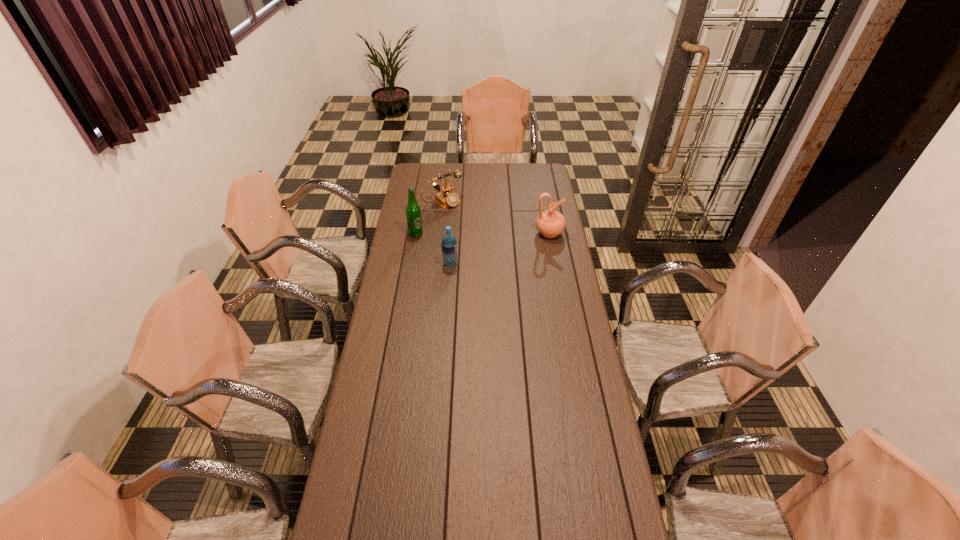
You are a GUI agent. You are given a task and a screenshot of the screen. Output one action in this format:
    pyautogui.click(x=<x>, y=<y>)
    Task: Click on the free space that is in between the water bottle and the farthest object
    Image resolution: width=960 pixels, height=540 pixels.
    Given the screenshot: What is the action you would take?
    pyautogui.click(x=446, y=233)

Locate which object is the second closest to the beer bottle. Please provide its 2D coordinates. Your answer should be formatted as a tuple, i.e. [(x, y)], where the tuple contains the x and y coordinates of a point satisfying the conditions above.

[(449, 243)]

The image size is (960, 540). I want to click on object that is the closest to the water bottle, so [413, 211].

The width and height of the screenshot is (960, 540). I want to click on vacant area in the image that satisfies the following two spatial constraints: 1. on the front side of the beer bottle; 2. on the right side of the nearest object, so click(x=411, y=264).

Locate an element on the screen. vacant space that satisfies the following two spatial constraints: 1. on the front side of the pottery; 2. on the spout of the telephone is located at coordinates (440, 233).

The image size is (960, 540). Find the location of `free space that satisfies the following two spatial constraints: 1. on the back side of the water bottle; 2. on the spout of the pottery`. free space that satisfies the following two spatial constraints: 1. on the back side of the water bottle; 2. on the spout of the pottery is located at coordinates (452, 233).

Where is `vacant position in the image that satisfies the following two spatial constraints: 1. on the back side of the nearest object; 2. on the spout of the rightmost object`? Image resolution: width=960 pixels, height=540 pixels. vacant position in the image that satisfies the following two spatial constraints: 1. on the back side of the nearest object; 2. on the spout of the rightmost object is located at coordinates (452, 233).